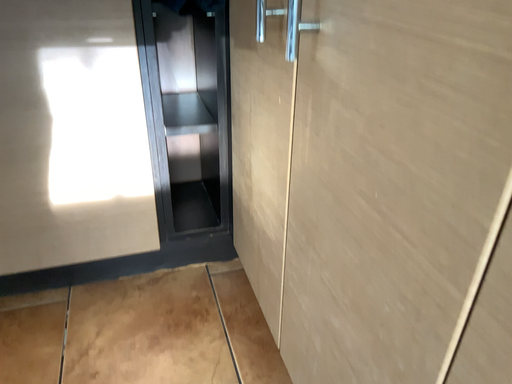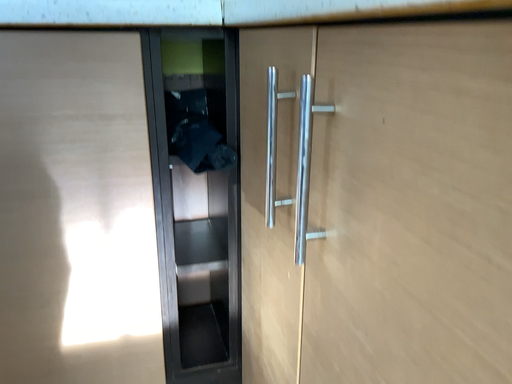
Question: Which way did the camera rotate in the video?

Choices:
 (A) rotated downward
 (B) rotated upward

Answer: (B)